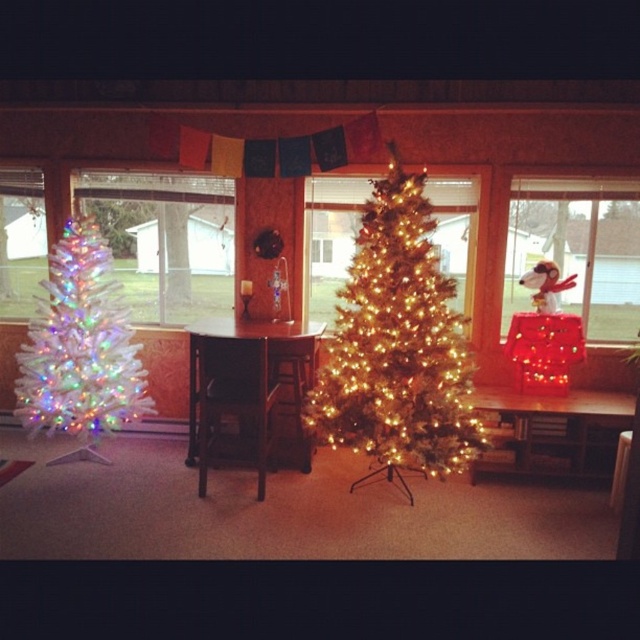
You are a guest in this Christmas room and want to place a rectangular gift box that is 1.2 meters wide. You have two options to place it horizontally between the red fabric snoopy at right and the clear glass window at left. Which object will allow the gift box to fit better based on their widths?

The red fabric snoopy at right has a larger width than the clear glass window at left. Since the gift box is 1.2 meters wide, placing it next to the red fabric snoopy at right would provide more space for the gift box to fit horizontally compared to the clear glass window at left.

You are a guest at a Christmas party and want to take a photo with both the iridescent gold christmas tree at center and the red fabric snoopy at right. Since you want both to be clearly visible in the photo, which object should you position closer to the camera to ensure they appear the same size in the photo?

To make the iridescent gold christmas tree at center and the red fabric snoopy at right appear the same size in the photo, you should position the smaller red fabric snoopy at right closer to the camera since it is smaller than the larger iridescent gold christmas tree at center.